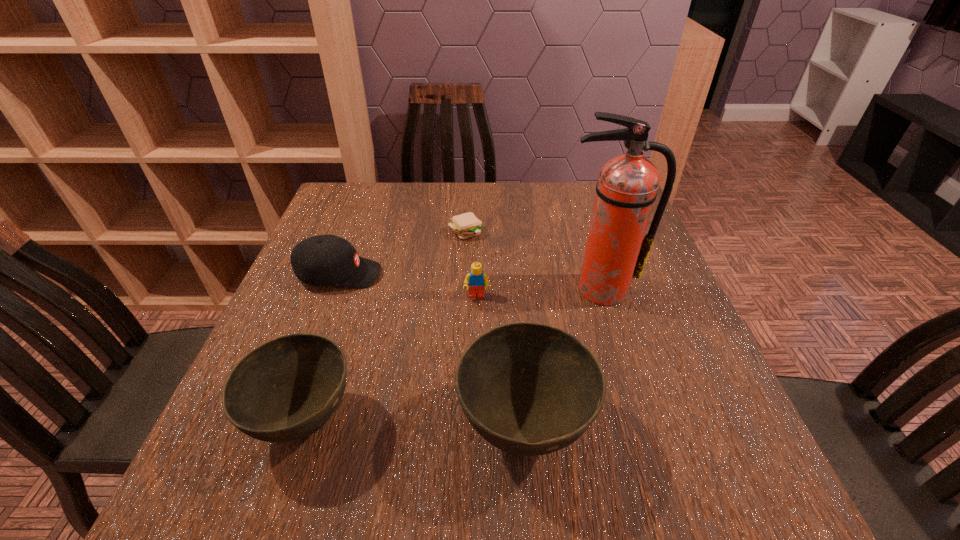
Where is `the left bowl`? Image resolution: width=960 pixels, height=540 pixels. the left bowl is located at coordinates (286, 389).

Where is `the shorter bowl`? This screenshot has height=540, width=960. the shorter bowl is located at coordinates (286, 389).

Identify the location of the taller bowl. Image resolution: width=960 pixels, height=540 pixels. (529, 389).

Locate an element on the screen. The height and width of the screenshot is (540, 960). the right bowl is located at coordinates (529, 389).

You are a GUI agent. You are given a task and a screenshot of the screen. Output one action in this format:
    pyautogui.click(x=<x>, y=<y>)
    Task: Click on the patty
    
    Given the screenshot: What is the action you would take?
    pyautogui.click(x=466, y=225)

This screenshot has height=540, width=960. In order to click on the farthest object in this screenshot , I will do `click(466, 225)`.

This screenshot has width=960, height=540. In order to click on the tallest object in this screenshot , I will do `click(615, 252)`.

The width and height of the screenshot is (960, 540). In order to click on baseball cap in this screenshot , I will do coord(322,260).

Find the location of `Lego`. Lego is located at coordinates pyautogui.click(x=476, y=279).

Find the location of `free space located 0.120m on the right of the left bowl`. free space located 0.120m on the right of the left bowl is located at coordinates (427, 421).